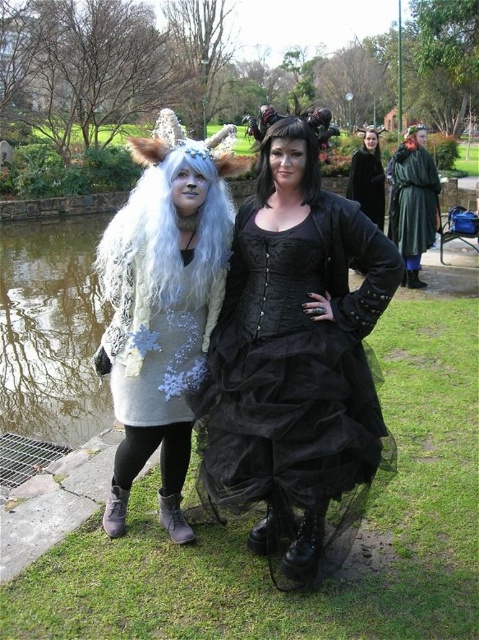
You are standing at point (50, 330) in the park. What object is located exactly at this point?

The transparent glass pond at left is located exactly at point (50, 330).

You are standing in the park and want to take a photo of the fuzzy white scarf at left. Where should you position yourself to capture it in the frame?

Position yourself so that the fuzzy white scarf at left is centered at coordinates approximately 0.534 on the horizontal axis and 0.509 on the vertical axis to capture it in the frame.